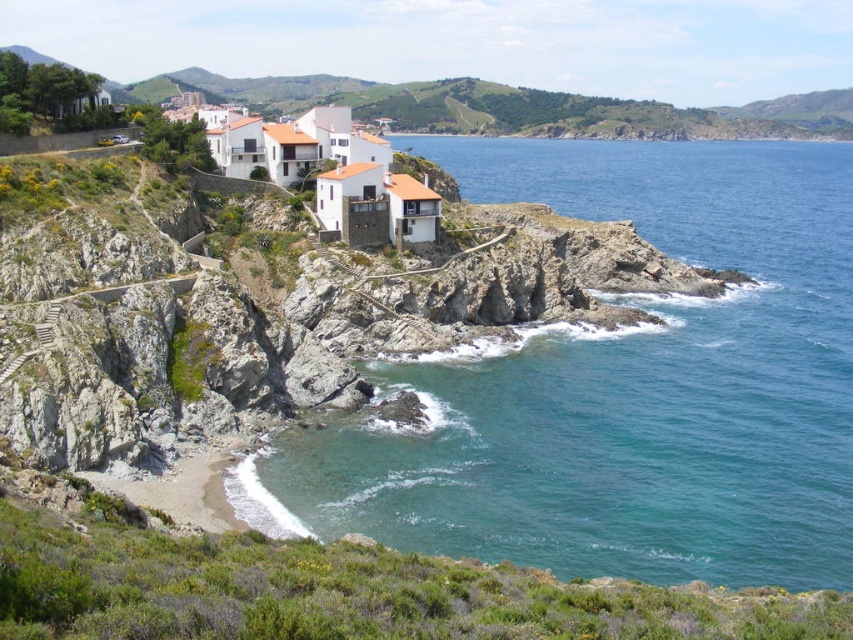
Question: Is blue water at lower right to the left of white matte houses at upper center from the viewer's perspective?

Choices:
 (A) no
 (B) yes

Answer: (A)

Question: Is blue water at lower right positioned behind white matte houses at upper center?

Choices:
 (A) yes
 (B) no

Answer: (B)

Question: Which object is closer to the camera taking this photo?

Choices:
 (A) white matte houses at upper center
 (B) blue water at lower right

Answer: (B)

Question: Can you confirm if blue water at lower right is bigger than white matte houses at upper center?

Choices:
 (A) no
 (B) yes

Answer: (B)

Question: Which point appears farthest from the camera in this image?

Choices:
 (A) [x=846, y=99]
 (B) [x=537, y=400]

Answer: (A)